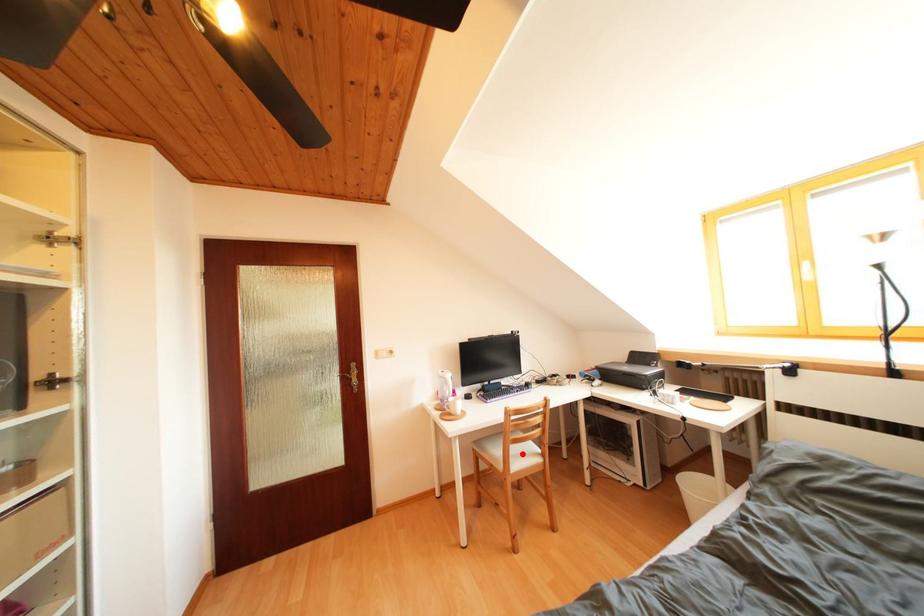
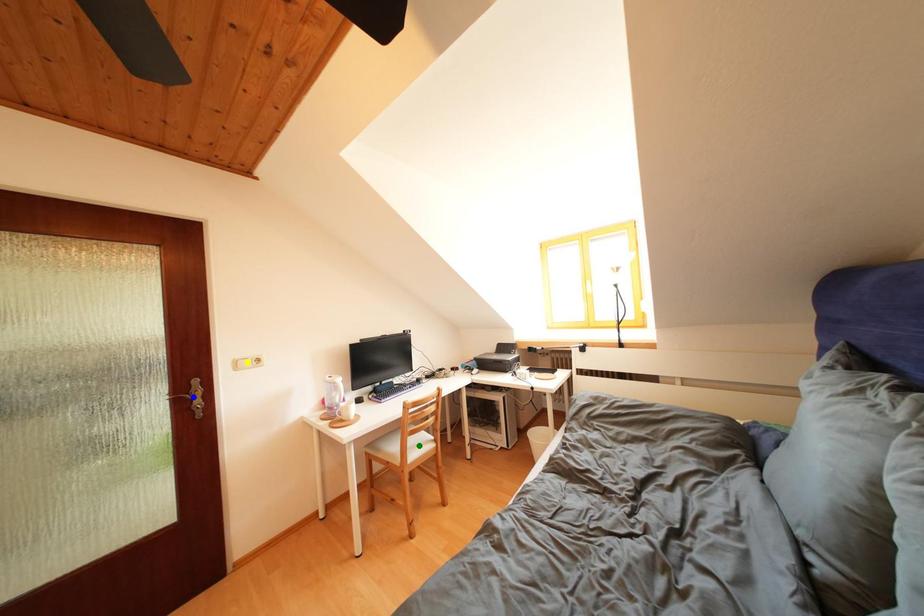
Question: I am providing you with two images of the same scene from different viewpoints. A red point is marked on the first image. You are given multiple points on the second image. Which point in image 2 represents the same 3d spot as the red point in image 1?

Choices:
 (A) yellow point
 (B) blue point
 (C) green point

Answer: (C)